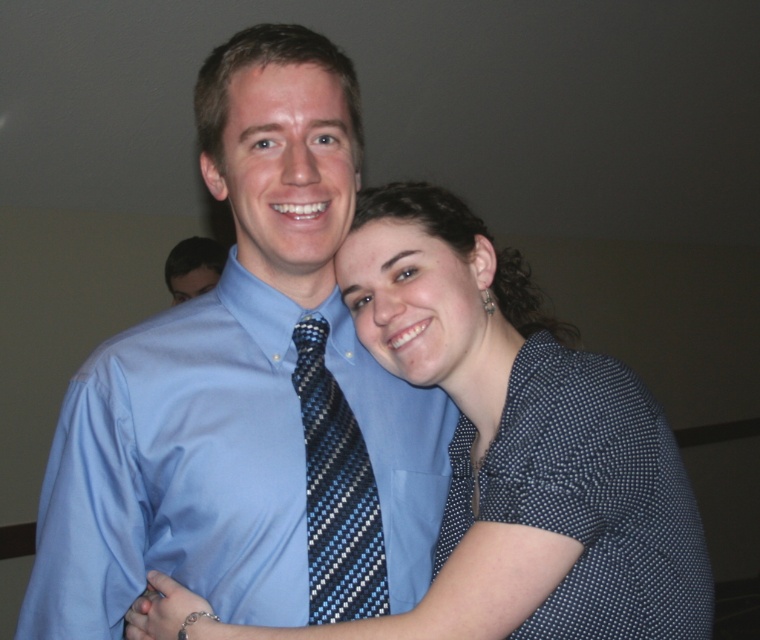
Question: Can you confirm if blue striped tie at center is positioned above blue silk shirt at center?

Choices:
 (A) no
 (B) yes

Answer: (A)

Question: Can you confirm if blue striped tie at center is thinner than blue silk shirt at center?

Choices:
 (A) yes
 (B) no

Answer: (A)

Question: Which is nearer to the blue silk shirt at center?

Choices:
 (A) light blue satin shirt at center
 (B) blue striped tie at center
 (C) dark blue dotted dress at right

Answer: (A)

Question: Estimate the real-world distances between objects in this image. Which object is farther from the light blue satin shirt at center?

Choices:
 (A) blue striped tie at center
 (B) blue silk shirt at center
 (C) dark blue dotted dress at right

Answer: (B)

Question: Which object is positioned closest to the dark blue dotted dress at right?

Choices:
 (A) light blue satin shirt at center
 (B) blue striped tie at center
 (C) blue silk shirt at center

Answer: (B)

Question: Is the position of light blue satin shirt at center more distant than that of blue silk shirt at center?

Choices:
 (A) yes
 (B) no

Answer: (B)